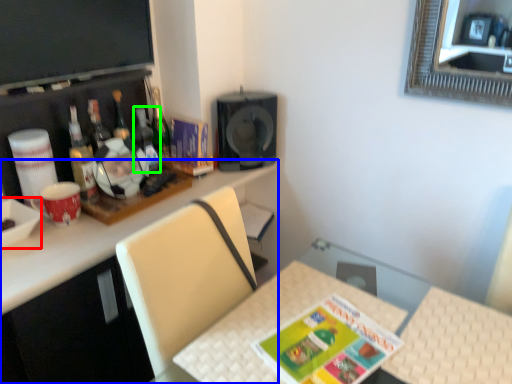
Question: Based on their relative distances, which object is nearer to bowl (highlighted by a red box)? Choose from desk (highlighted by a blue box) and bottle (highlighted by a green box).

Choices:
 (A) desk
 (B) bottle

Answer: (A)